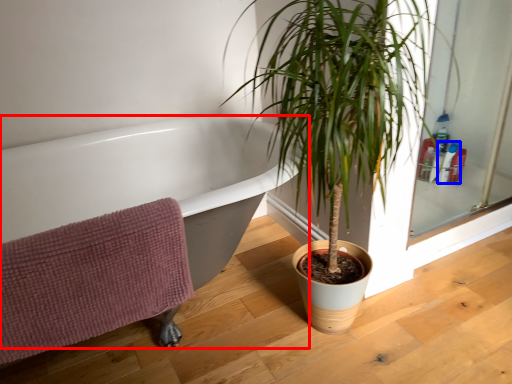
Question: Which object appears farthest to the camera in this image, bathtub (highlighted by a red box) or toiletry (highlighted by a blue box)?

Choices:
 (A) bathtub
 (B) toiletry

Answer: (B)